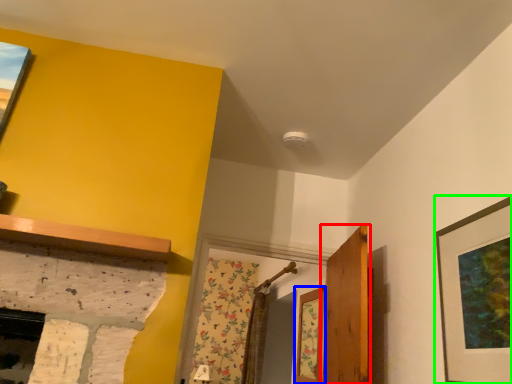
Question: Which object is the farthest from door (highlighted by a red box)? Choose among these: window (highlighted by a blue box) or picture frame (highlighted by a green box).

Choices:
 (A) window
 (B) picture frame

Answer: (B)